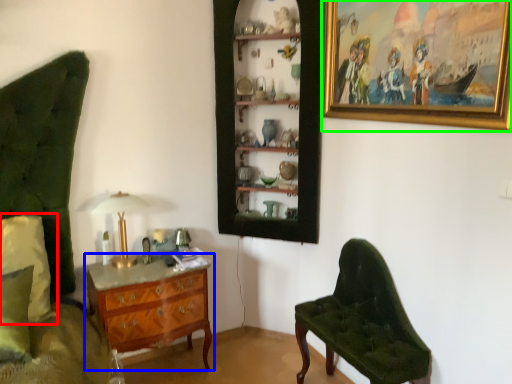
Question: Estimate the real-world distances between objects in this image. Which object is closer to pillow (highlighted by a red box), chest of drawers (highlighted by a blue box) or picture frame (highlighted by a green box)?

Choices:
 (A) chest of drawers
 (B) picture frame

Answer: (A)